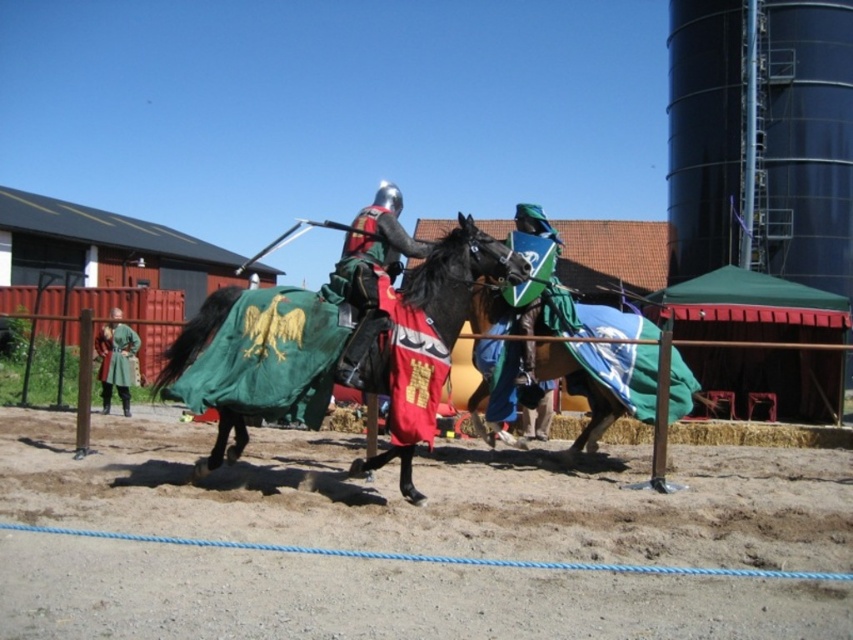
Question: Can you confirm if shiny green shield at center is positioned to the right of green leather jacket at left?

Choices:
 (A) yes
 (B) no

Answer: (A)

Question: Which point is farther to the camera?

Choices:
 (A) (529, 291)
 (B) (361, 330)
 (C) (497, 305)
 (D) (242, 289)

Answer: (C)

Question: Which object is positioned closest to the green leather jacket at left?

Choices:
 (A) shiny metallic armor at center
 (B) shiny green shield at center
 (C) shiny brown horse at center

Answer: (B)

Question: Estimate the real-world distances between objects in this image. Which object is closer to the shiny brown horse at center?

Choices:
 (A) brown sandy dirt at center
 (B) shiny metallic armor at center

Answer: (A)

Question: Is brown sandy dirt at center above green leather jacket at left?

Choices:
 (A) yes
 (B) no

Answer: (B)

Question: Is green velvet horse at center to the right of green leather jacket at left from the viewer's perspective?

Choices:
 (A) yes
 (B) no

Answer: (A)